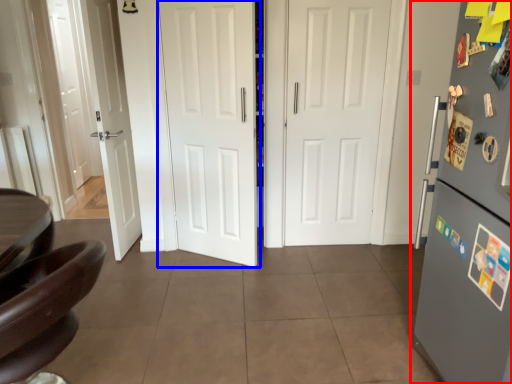
Question: Which object is further to the camera taking this photo, refrigerator (highlighted by a red box) or door (highlighted by a blue box)?

Choices:
 (A) refrigerator
 (B) door

Answer: (B)